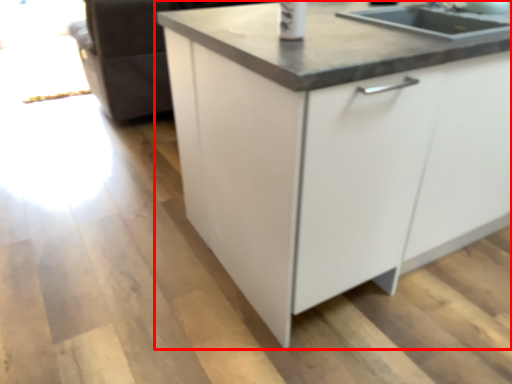
Question: From the image's perspective, where is cabinetry (annotated by the red box) located relative to countertop?

Choices:
 (A) above
 (B) below

Answer: (B)